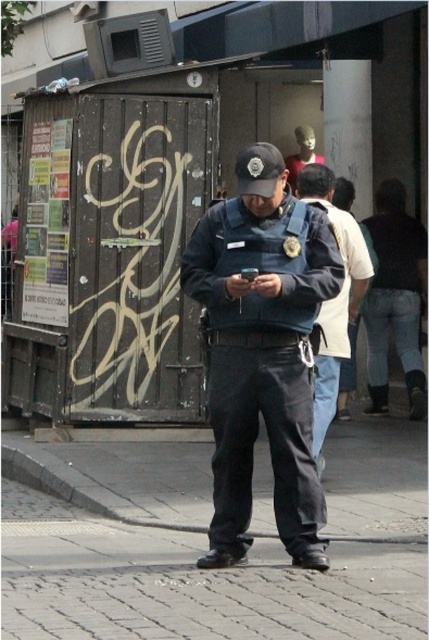
Which is above, dark blue uniform at center or light blue denim jeans at center?

light blue denim jeans at center is above.

Locate an element on the screen. Image resolution: width=429 pixels, height=640 pixels. dark blue uniform at center is located at coordinates tap(262, 349).

Identify the location of dark blue uniform at center. This screenshot has height=640, width=429. 262,349.

Between gray cobblestone pavement at center and smooth plastic head at center, which one appears on the right side from the viewer's perspective?

smooth plastic head at center

The image size is (429, 640). What do you see at coordinates (205, 541) in the screenshot?
I see `gray cobblestone pavement at center` at bounding box center [205, 541].

The height and width of the screenshot is (640, 429). What do you see at coordinates (205, 541) in the screenshot?
I see `gray cobblestone pavement at center` at bounding box center [205, 541].

Image resolution: width=429 pixels, height=640 pixels. What are the coordinates of `gray cobblestone pavement at center` in the screenshot? It's located at (205, 541).

Does gray cobblestone pavement at center appear on the right side of dark blue uniform at center?

In fact, gray cobblestone pavement at center is to the left of dark blue uniform at center.

From the picture: Is gray cobblestone pavement at center to the left of dark blue uniform at center from the viewer's perspective?

Yes, gray cobblestone pavement at center is to the left of dark blue uniform at center.

Image resolution: width=429 pixels, height=640 pixels. I want to click on gray cobblestone pavement at center, so click(x=205, y=541).

Image resolution: width=429 pixels, height=640 pixels. Find the location of `gray cobblestone pavement at center`. gray cobblestone pavement at center is located at coordinates (205, 541).